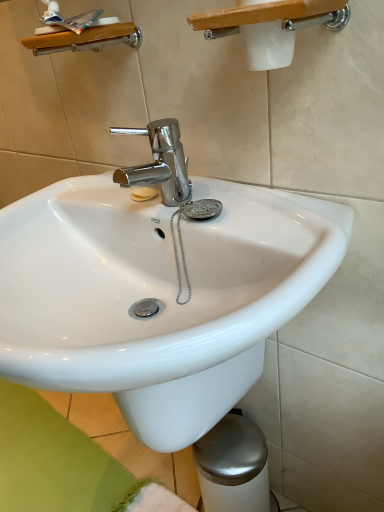
Question: Can you confirm if white plastic shower at upper center, the second shower positioned from the back, is taller than white glossy sink at center?

Choices:
 (A) no
 (B) yes

Answer: (A)

Question: From a real-world perspective, is white plastic shower at upper center, the second shower positioned from the back, on white glossy sink at center?

Choices:
 (A) yes
 (B) no

Answer: (A)

Question: Is white plastic shower at upper center, which is the first shower in front-to-back order, bigger than white glossy sink at center?

Choices:
 (A) yes
 (B) no

Answer: (B)

Question: Considering the relative sizes of white plastic shower at upper center, which is the first shower in front-to-back order, and white glossy sink at center in the image provided, is white plastic shower at upper center, which is the first shower in front-to-back order, wider than white glossy sink at center?

Choices:
 (A) yes
 (B) no

Answer: (B)

Question: Is white plastic shower at upper center, the 1th shower positioned from the right, at the left side of white glossy sink at center?

Choices:
 (A) no
 (B) yes

Answer: (A)

Question: Is white glossy sink at center bigger or smaller than white plastic shower at upper center, the second shower positioned from the back?

Choices:
 (A) big
 (B) small

Answer: (A)

Question: Is point (x=205, y=223) closer or farther from the camera than point (x=340, y=11)?

Choices:
 (A) farther
 (B) closer

Answer: (A)

Question: From their relative heights in the image, would you say white glossy sink at center is taller or shorter than white plastic shower at upper center, the second shower in the left-to-right sequence?

Choices:
 (A) short
 (B) tall

Answer: (B)

Question: Is white glossy sink at center inside or outside of white plastic shower at upper center, the second shower in the left-to-right sequence?

Choices:
 (A) outside
 (B) inside

Answer: (A)

Question: Visually, is wooden shelf at upper left, the second shower from the front, positioned to the left or to the right of white glossy sink at center?

Choices:
 (A) right
 (B) left

Answer: (B)

Question: From their relative heights in the image, would you say wooden shelf at upper left, which is the 2th shower in right-to-left order, is taller or shorter than white glossy sink at center?

Choices:
 (A) tall
 (B) short

Answer: (B)

Question: From the image's perspective, is wooden shelf at upper left, the second shower from the front, positioned above or below white glossy sink at center?

Choices:
 (A) below
 (B) above

Answer: (B)

Question: Considering their positions, is wooden shelf at upper left, the first shower in the back-to-front sequence, located in front of or behind white glossy sink at center?

Choices:
 (A) behind
 (B) front

Answer: (A)

Question: From their relative heights in the image, would you say wooden shelf at upper left, the 1th shower viewed from the left, is taller or shorter than white plastic shower at upper center, the 1th shower positioned from the right?

Choices:
 (A) short
 (B) tall

Answer: (B)

Question: Is wooden shelf at upper left, the 1th shower viewed from the left, wider or thinner than white plastic shower at upper center, the second shower positioned from the back?

Choices:
 (A) thin
 (B) wide

Answer: (A)